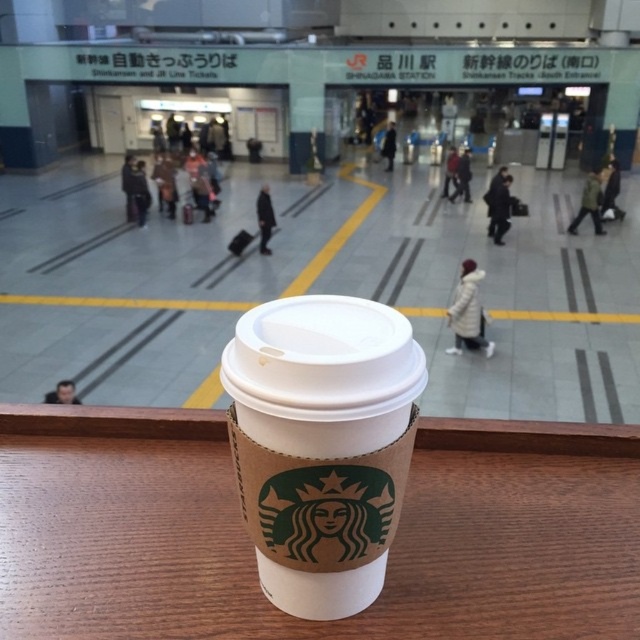
Based on the photo, you are a traveler sitting at the wooden table at center in Shinagawa Station. You want to grab your brown paper cup at center without leaving your seat. Can you reach it easily?

The brown paper cup at center is behind the wooden table at center, so you cannot reach it easily without moving from your seat.